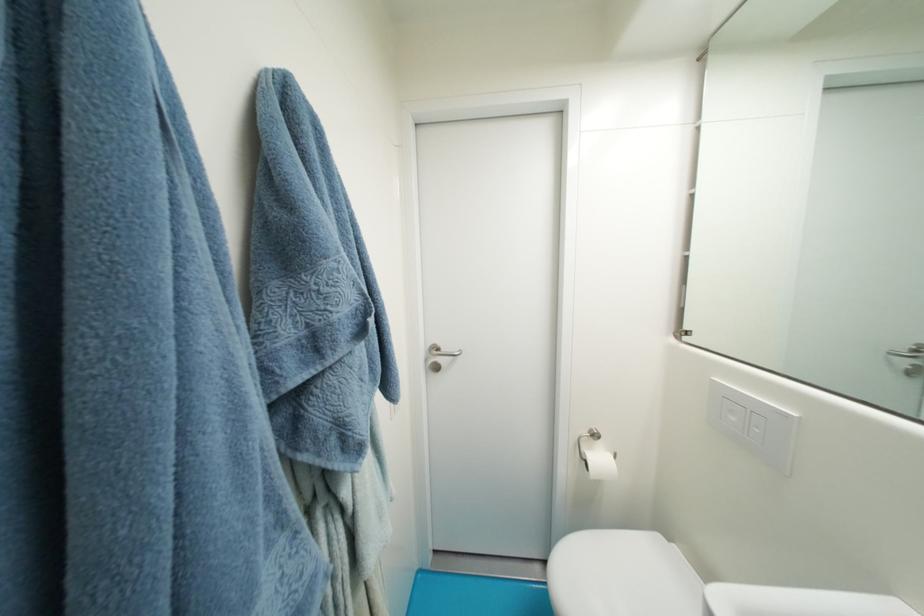
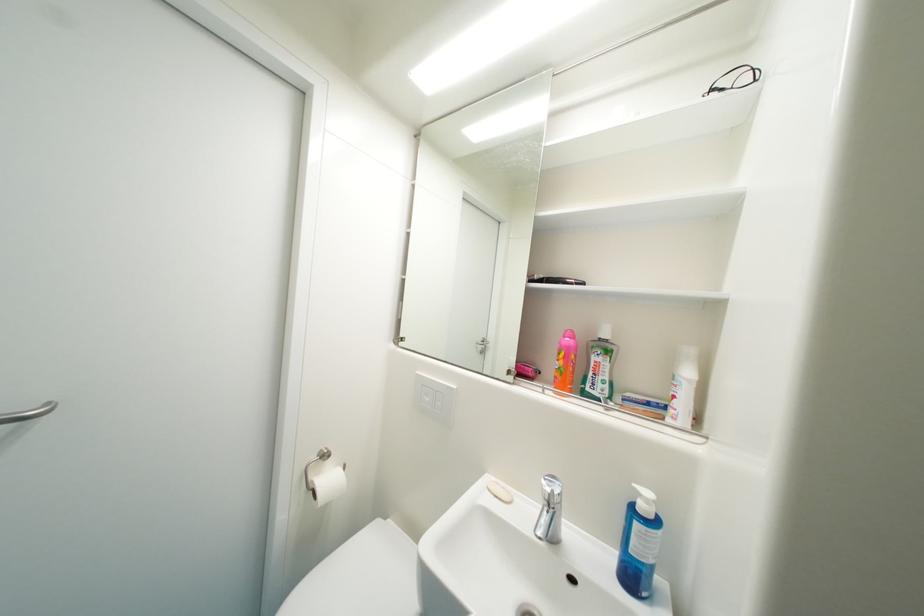
Question: I am providing you with two images of the same scene from different viewpoints. Please identify which objects are invisible in image2.

Choices:
 (A) pink bottle cap
 (B) toilet paper roll
 (C) silver door handle
 (D) none of these

Answer: (D)